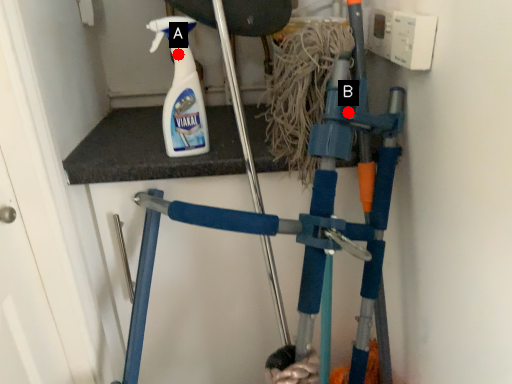
Question: Two points are circled on the image, labeled by A and B beside each circle. Which of the following is the farthest from the observer?

Choices:
 (A) A is further
 (B) B is further

Answer: (A)